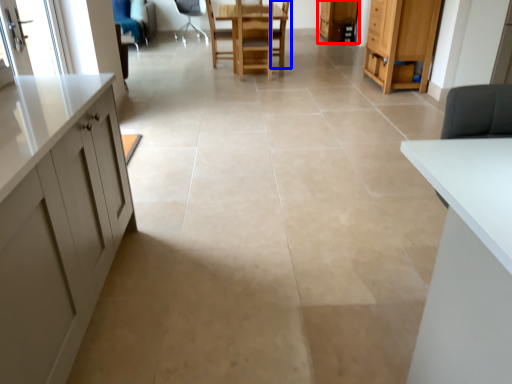
Question: Among these objects, which one is farthest to the camera, cabinetry (highlighted by a red box) or armchair (highlighted by a blue box)?

Choices:
 (A) cabinetry
 (B) armchair

Answer: (A)